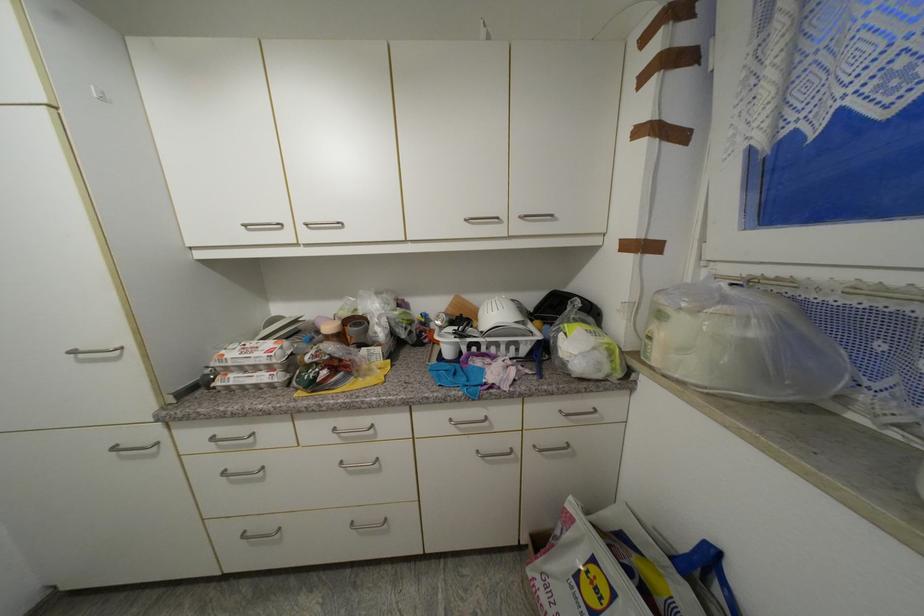
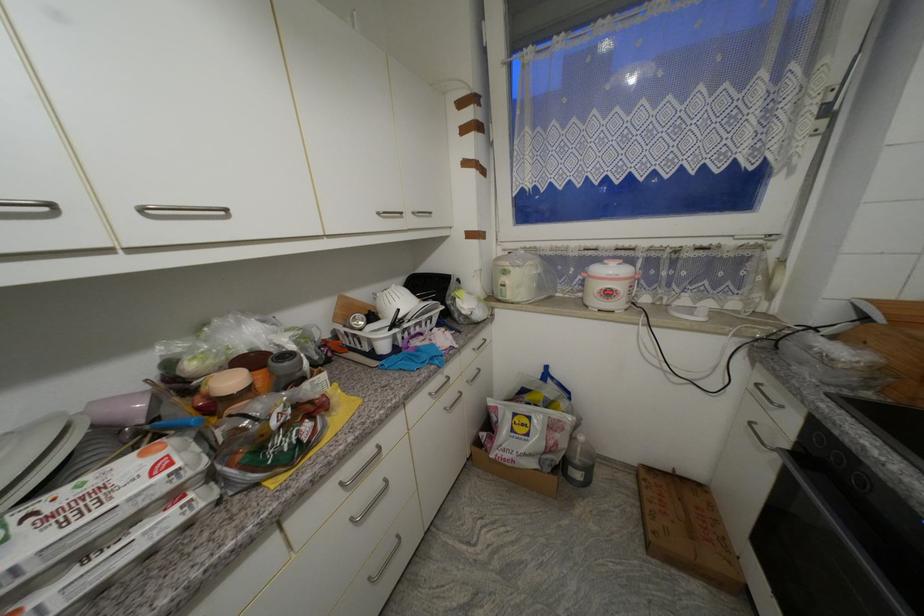
Find the pixel in the second image that matches [492,444] in the first image.

(455, 398)